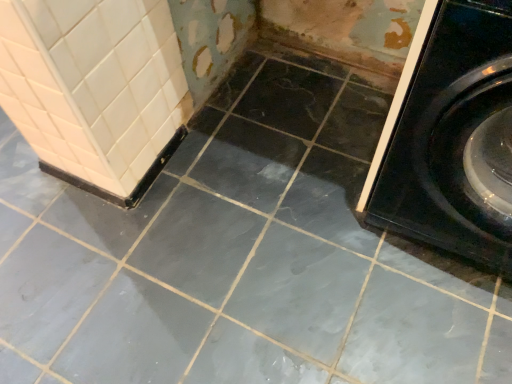
This screenshot has height=384, width=512. Find the location of `black glossy washing machine at right`. black glossy washing machine at right is located at coordinates (451, 136).

What do you see at coordinates (451, 136) in the screenshot? The width and height of the screenshot is (512, 384). I see `black glossy washing machine at right` at bounding box center [451, 136].

The height and width of the screenshot is (384, 512). Identify the location of black glossy washing machine at right. (451, 136).